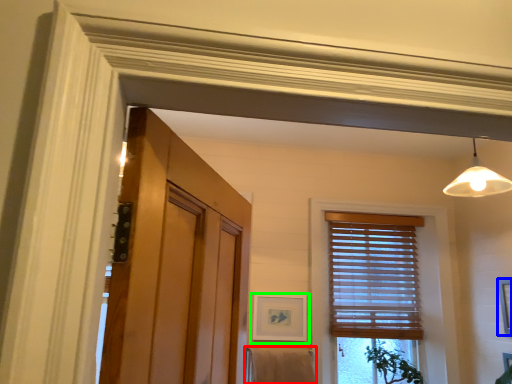
Question: Based on their relative distances, which object is nearer to bath towel (highlighted by a red box)? Choose from picture frame (highlighted by a blue box) and picture frame (highlighted by a green box).

Choices:
 (A) picture frame
 (B) picture frame

Answer: (B)